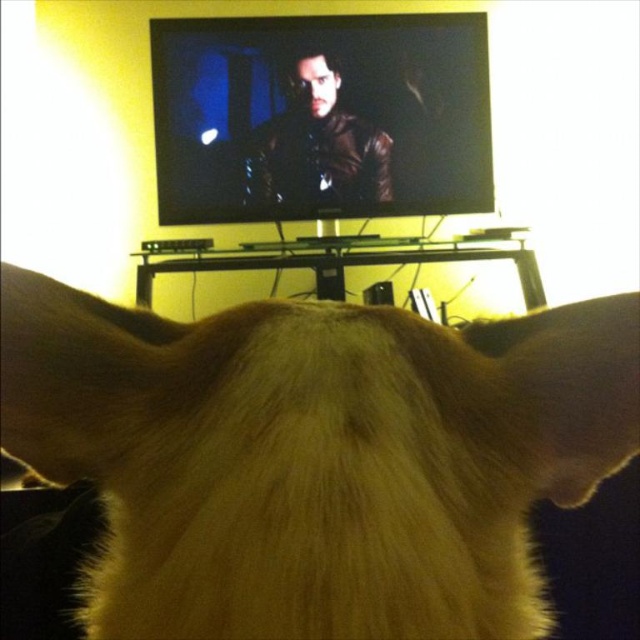
You are placing a new speaker system that requires precise positioning. The black glass entertainment center at center is your reference point. According to the coordinates provided, is the entertainment center closer to the left or right side of the room?

The black glass entertainment center at center is located at point 0.405 on the x and y axis, which means it is positioned closer to the left side of the room since the coordinate is less than 0.5. Therefore, the entertainment center is closer to the left side of the room.

You are trying to place a new decorative item on the surface between the brown fur at center and the black glass entertainment center at center. Based on their sizes, which object should you place the item closer to for stability?

The brown fur at center occupies less space than the black glass entertainment center at center, so placing the item closer to the black glass entertainment center at center would provide a more stable base due to its larger surface area.

You are a delivery robot with a package that is 24 inches wide. You need to place it on the surface between the black glass entertainment center at center and the matte black nose at upper center. Can you fit the package there?

The distance between the black glass entertainment center at center and the matte black nose at upper center is 23.23 inches, so the package that is 24 inches wide cannot fit in that space.